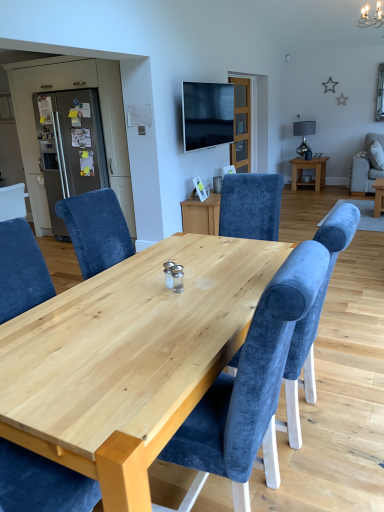
Question: Is flat screen tv at upper center at the right side of metallic gray refrigerator at left?

Choices:
 (A) no
 (B) yes

Answer: (B)

Question: Is flat screen tv at upper center positioned far away from metallic gray refrigerator at left?

Choices:
 (A) no
 (B) yes

Answer: (B)

Question: Is flat screen tv at upper center looking in the opposite direction of metallic gray refrigerator at left?

Choices:
 (A) no
 (B) yes

Answer: (B)

Question: Can you confirm if flat screen tv at upper center is taller than metallic gray refrigerator at left?

Choices:
 (A) no
 (B) yes

Answer: (A)

Question: From the image's perspective, does flat screen tv at upper center appear higher than metallic gray refrigerator at left?

Choices:
 (A) no
 (B) yes

Answer: (B)

Question: Considering the positions of flat screen tv at upper center and velvet blue chair at center, which appears as the 1th chair when ordered from the bottom, in the image, is flat screen tv at upper center taller or shorter than velvet blue chair at center, which appears as the 1th chair when ordered from the bottom,?

Choices:
 (A) tall
 (B) short

Answer: (B)

Question: In the image, is flat screen tv at upper center positioned in front of or behind velvet blue chair at center, which is the 1th chair from front to back?

Choices:
 (A) front
 (B) behind

Answer: (B)

Question: From the image's perspective, is flat screen tv at upper center positioned above or below velvet blue chair at center, the second chair in the right-to-left sequence?

Choices:
 (A) above
 (B) below

Answer: (A)

Question: Is flat screen tv at upper center situated inside velvet blue chair at center, the 2th chair when ordered from back to front, or outside?

Choices:
 (A) inside
 (B) outside

Answer: (B)

Question: Is natural wood table at center spatially inside satin silver refrigerator at left, or outside of it?

Choices:
 (A) outside
 (B) inside

Answer: (A)

Question: Is natural wood table at center wider or thinner than satin silver refrigerator at left?

Choices:
 (A) thin
 (B) wide

Answer: (B)

Question: Is point (210, 275) positioned closer to the camera than point (130, 219)?

Choices:
 (A) closer
 (B) farther

Answer: (A)

Question: From the image's perspective, is natural wood table at center located above or below satin silver refrigerator at left?

Choices:
 (A) above
 (B) below

Answer: (B)

Question: In the image, is velvet blue chair at right, which appears as the 1th chair when viewed from the top, positioned in front of or behind matte gray refrigerator at left?

Choices:
 (A) behind
 (B) front

Answer: (A)

Question: Looking at their shapes, would you say velvet blue chair at right, positioned as the 1th chair in right-to-left order, is wider or thinner than matte gray refrigerator at left?

Choices:
 (A) wide
 (B) thin

Answer: (A)